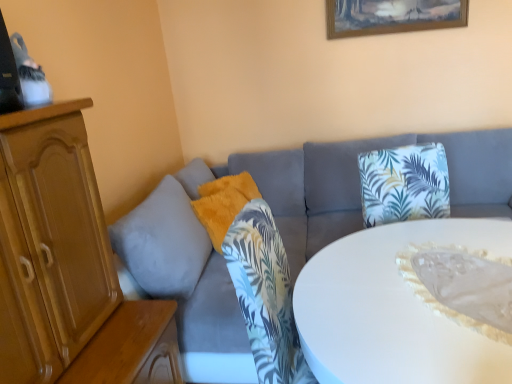
Question: Is white glossy table at center far from wooden picture frame at upper center?

Choices:
 (A) yes
 (B) no

Answer: (A)

Question: Is white glossy table at center at the left side of wooden picture frame at upper center?

Choices:
 (A) no
 (B) yes

Answer: (B)

Question: Is white glossy table at center facing towards wooden picture frame at upper center?

Choices:
 (A) yes
 (B) no

Answer: (B)

Question: Considering the relative sizes of white glossy table at center and wooden picture frame at upper center in the image provided, is white glossy table at center taller than wooden picture frame at upper center?

Choices:
 (A) no
 (B) yes

Answer: (B)

Question: Is white glossy table at center wider than wooden picture frame at upper center?

Choices:
 (A) yes
 (B) no

Answer: (A)

Question: Is the position of white glossy table at center less distant than that of wooden picture frame at upper center?

Choices:
 (A) yes
 (B) no

Answer: (A)

Question: Does wooden picture frame at upper center have a lesser height compared to white glossy table at center?

Choices:
 (A) yes
 (B) no

Answer: (A)

Question: Is wooden picture frame at upper center at the left side of white glossy table at center?

Choices:
 (A) no
 (B) yes

Answer: (A)

Question: Is white glossy table at center completely or partially inside wooden picture frame at upper center?

Choices:
 (A) no
 (B) yes

Answer: (A)

Question: Considering the relative sizes of wooden picture frame at upper center and white glossy table at center in the image provided, is wooden picture frame at upper center thinner than white glossy table at center?

Choices:
 (A) yes
 (B) no

Answer: (A)

Question: From the image's perspective, is wooden picture frame at upper center located beneath white glossy table at center?

Choices:
 (A) no
 (B) yes

Answer: (A)

Question: Does wooden picture frame at upper center have a smaller size compared to white glossy table at center?

Choices:
 (A) yes
 (B) no

Answer: (A)

Question: Is the position of fuzzy orange pillow at center less distant than that of white glossy table at center?

Choices:
 (A) no
 (B) yes

Answer: (A)